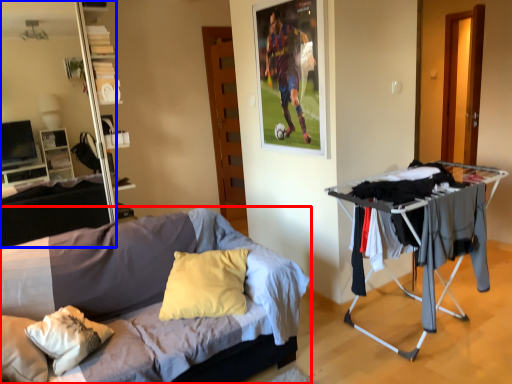
Question: Which object is closer to the camera taking this photo, bed (highlighted by a red box) or entertainment center (highlighted by a blue box)?

Choices:
 (A) bed
 (B) entertainment center

Answer: (A)